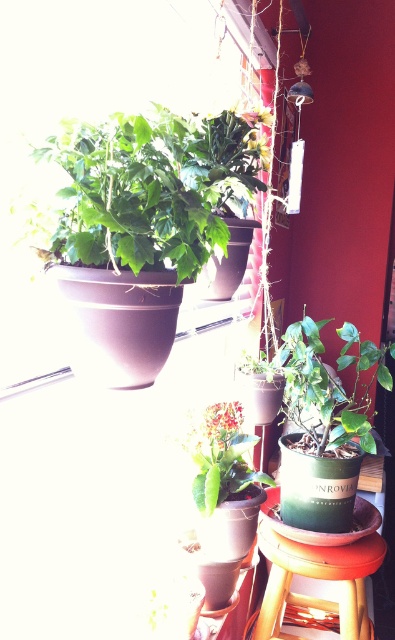
You are a delivery person who needs to place a package between the matte brown pot at upper left and the green matte plant at center. The package is 20 inches long. Will it fit in the space between them?

The distance between the matte brown pot at upper left and the green matte plant at center is 22.53 inches. Since the package is 20 inches long, it will fit in the space between them.

You are arranging plants in a sunlit room and need to place the matte brown pot at upper left and the green matte plant at center. Based on their positions, which object is closer to the window that is letting in the sunlight?

The matte brown pot at upper left is closer to the window because it is positioned to the left of the green matte plant at center, and since the window is in the scene, the left side would be nearer to it.

You are a gardener who wants to place a new plant between the matte brown pot at upper left and the green matte plant at lower right. Based on their heights, which one should you place the new plant closer to?

The matte brown pot at upper left is shorter than the green matte plant at lower right, so you should place the new plant closer to the green matte plant at lower right to maintain a balanced arrangement.